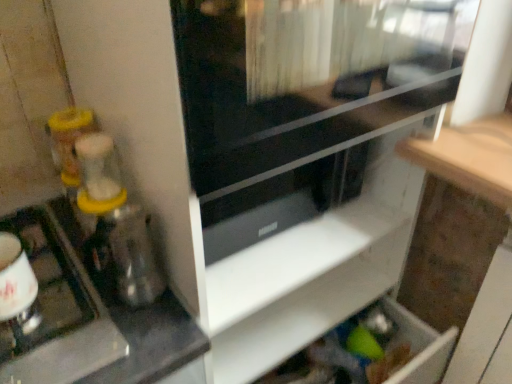
Question: Is transparent glass screen door at upper center positioned in front of metallic silver kettle at left?

Choices:
 (A) no
 (B) yes

Answer: (B)

Question: Is transparent glass screen door at upper center placed right next to metallic silver kettle at left?

Choices:
 (A) yes
 (B) no

Answer: (B)

Question: From the image's perspective, would you say transparent glass screen door at upper center is shown under metallic silver kettle at left?

Choices:
 (A) no
 (B) yes

Answer: (A)

Question: Is transparent glass screen door at upper center turned away from metallic silver kettle at left?

Choices:
 (A) yes
 (B) no

Answer: (B)

Question: Is transparent glass screen door at upper center completely or partially outside of metallic silver kettle at left?

Choices:
 (A) no
 (B) yes

Answer: (B)

Question: From the image's perspective, is white matte drawer at lower center above or below transparent plastic blender at left?

Choices:
 (A) below
 (B) above

Answer: (A)

Question: Is white matte drawer at lower center taller or shorter than transparent plastic blender at left?

Choices:
 (A) tall
 (B) short

Answer: (B)

Question: Is white matte drawer at lower center inside or outside of transparent plastic blender at left?

Choices:
 (A) outside
 (B) inside

Answer: (A)

Question: Relative to transparent plastic blender at left, is white matte drawer at lower center in front or behind?

Choices:
 (A) front
 (B) behind

Answer: (B)

Question: Is metallic silver kettle at left bigger or smaller than white matte drawer at lower center?

Choices:
 (A) big
 (B) small

Answer: (B)

Question: Which is correct: metallic silver kettle at left is inside white matte drawer at lower center, or outside of it?

Choices:
 (A) outside
 (B) inside

Answer: (A)

Question: Is metallic silver kettle at left in front of or behind white matte drawer at lower center in the image?

Choices:
 (A) behind
 (B) front

Answer: (B)

Question: From the image's perspective, relative to white matte drawer at lower center, is metallic silver kettle at left above or below?

Choices:
 (A) below
 (B) above

Answer: (B)

Question: Considering the positions of metallic silver kettle at left and transparent glass screen door at upper center in the image, is metallic silver kettle at left wider or thinner than transparent glass screen door at upper center?

Choices:
 (A) thin
 (B) wide

Answer: (A)

Question: Based on their positions, is metallic silver kettle at left located to the left or right of transparent glass screen door at upper center?

Choices:
 (A) left
 (B) right

Answer: (A)